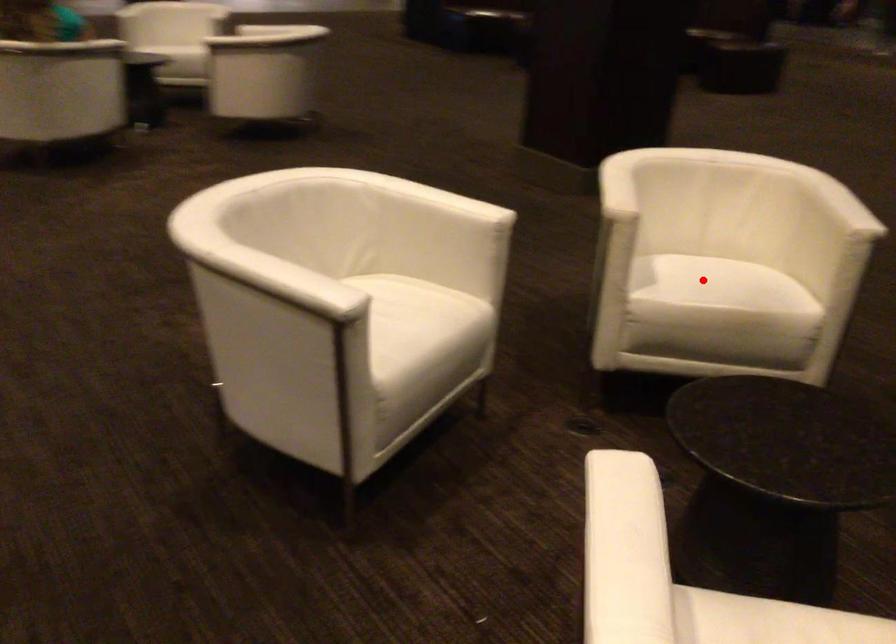
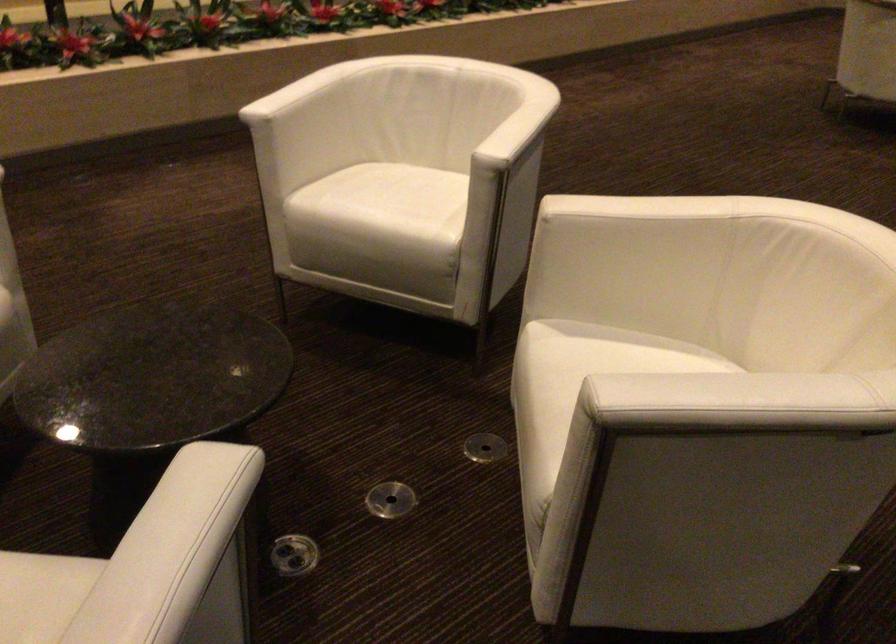
Question: I am providing you with two images of the same scene from different viewpoints. Image1 has a red point marked. In image2, the corresponding 3D location appears at what relative position? Reply with the corresponding letter.

Choices:
 (A) Closer
 (B) Farther

Answer: (A)